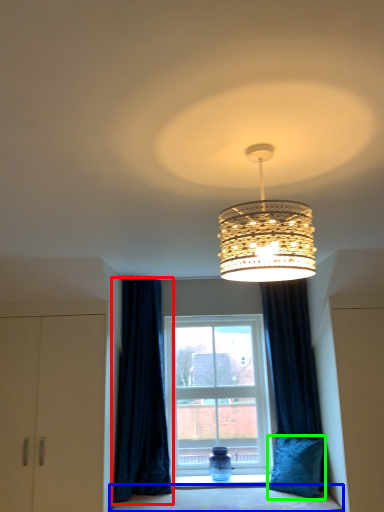
Question: Which object is the farthest from curtain (highlighted by a red box)? Choose among these: bedding (highlighted by a blue box) or pillow (highlighted by a green box).

Choices:
 (A) bedding
 (B) pillow

Answer: (B)